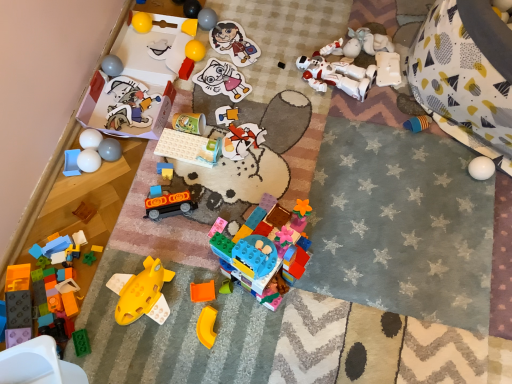
The height and width of the screenshot is (384, 512). In order to click on free space in front of smooth yellow ball at upper center, which is the 15th toy from left to right in this screenshot , I will do `click(211, 65)`.